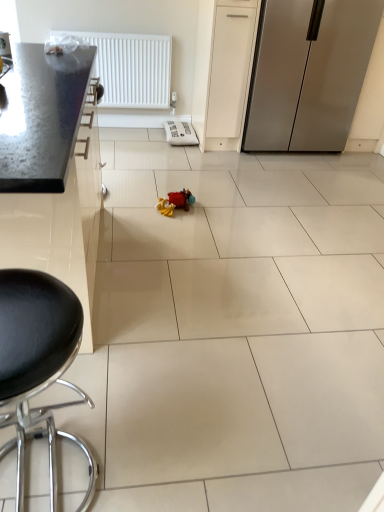
The image size is (384, 512). I want to click on blank space situated above black leather stool at lower left (from a real-world perspective), so click(30, 311).